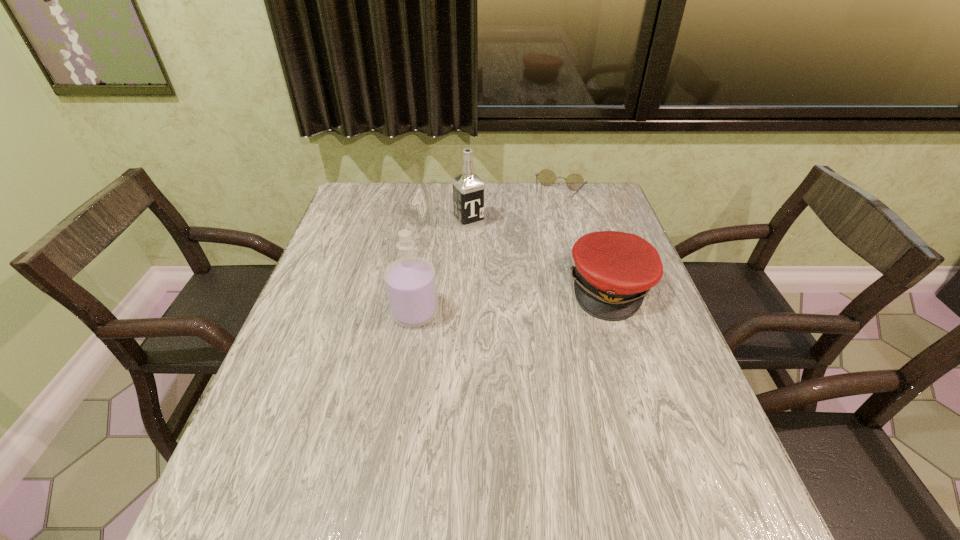
Find the location of a particular element. the leftmost object is located at coordinates (410, 282).

Where is `the second shortest object`? The image size is (960, 540). the second shortest object is located at coordinates (614, 271).

This screenshot has height=540, width=960. What are the coordinates of `the third object from right to left` in the screenshot? It's located at (468, 189).

In order to click on vodka in this screenshot , I will do `click(468, 189)`.

You are a GUI agent. You are given a task and a screenshot of the screen. Output one action in this format:
    pyautogui.click(x=<x>, y=<y>)
    Task: Click on the farthest object
    The height and width of the screenshot is (540, 960).
    Given the screenshot: What is the action you would take?
    pyautogui.click(x=575, y=182)

Where is `the shortest object`? Image resolution: width=960 pixels, height=540 pixels. the shortest object is located at coordinates (575, 182).

Where is `vacant region located 0.180m on the back of the perfume`? vacant region located 0.180m on the back of the perfume is located at coordinates (424, 253).

Find the location of a particular element. free space located on the front of the second shortest object with an emblem is located at coordinates (634, 358).

Image resolution: width=960 pixels, height=540 pixels. I want to click on vacant space situated on the front label of the second object from left to right, so click(484, 239).

The image size is (960, 540). I want to click on vacant space located on the front label of the second object from left to right, so click(x=529, y=290).